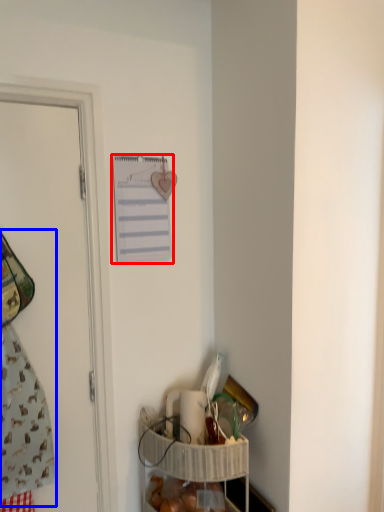
Question: Which object appears farthest to the camera in this image, journal (highlighted by a red box) or laundry (highlighted by a blue box)?

Choices:
 (A) journal
 (B) laundry

Answer: (A)